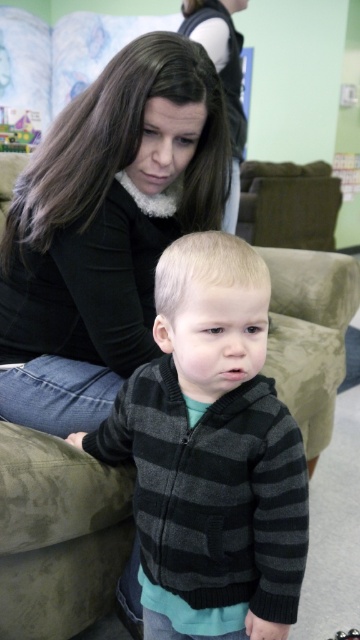
Is striped knit sweater at center positioned at the back of dark brown hair at upper center?

No.

You are a GUI agent. You are given a task and a screenshot of the screen. Output one action in this format:
    pyautogui.click(x=<x>, y=<y>)
    Task: Click on the striped knit sweater at center
    Image resolution: width=360 pixels, height=640 pixels.
    Given the screenshot: What is the action you would take?
    pyautogui.click(x=212, y=452)

Can you confirm if matte black sweater at center is positioned to the left of dark brown hair at upper center?

Yes, matte black sweater at center is to the left of dark brown hair at upper center.

Does point (97, 412) come farther from viewer compared to point (237, 140)?

No, (97, 412) is in front of (237, 140).

I want to click on matte black sweater at center, so click(x=105, y=228).

Who is taller, matte black sweater at center or striped knit sweater at center?

With more height is matte black sweater at center.

Who is shorter, matte black sweater at center or striped knit sweater at center?

With less height is striped knit sweater at center.

The height and width of the screenshot is (640, 360). Identify the location of matte black sweater at center. (105, 228).